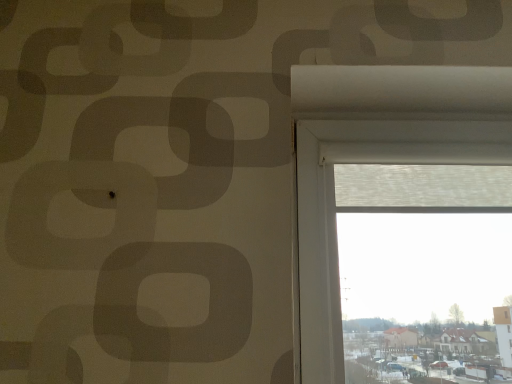
The image size is (512, 384). I want to click on white textured screen at upper right, so click(x=422, y=186).

Describe the element at coordinates (422, 186) in the screenshot. Image resolution: width=512 pixels, height=384 pixels. I see `white textured screen at upper right` at that location.

At what (x,y) coordinates should I click in order to perform the action: click on white textured screen at upper right. Please return your answer as a coordinate pair (x, y). The image size is (512, 384). Looking at the image, I should click on (422, 186).